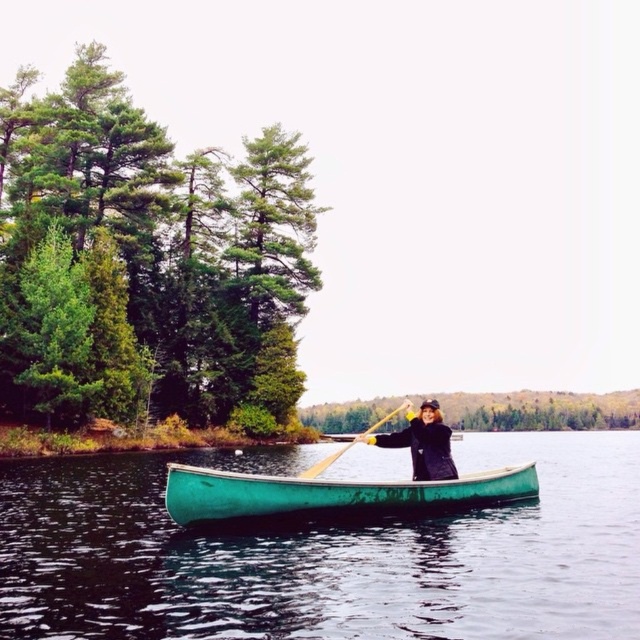
Question: Which point is closer to the camera?

Choices:
 (A) green polished wood canoe at center
 (B) black matte jacket at center
 (C) wooden at center

Answer: (A)

Question: Does green polished wood canoe at center appear under black matte jacket at center?

Choices:
 (A) yes
 (B) no

Answer: (B)

Question: Is green smooth water at center to the left of green polished wood canoe at center from the viewer's perspective?

Choices:
 (A) yes
 (B) no

Answer: (A)

Question: Among these points, which one is nearest to the camera?

Choices:
 (A) (280, 484)
 (B) (157, 586)

Answer: (B)

Question: Which of the following is the closest to the observer?

Choices:
 (A) (412, 451)
 (B) (502, 435)

Answer: (A)

Question: Does green smooth water at center appear on the left side of black matte jacket at center?

Choices:
 (A) yes
 (B) no

Answer: (A)